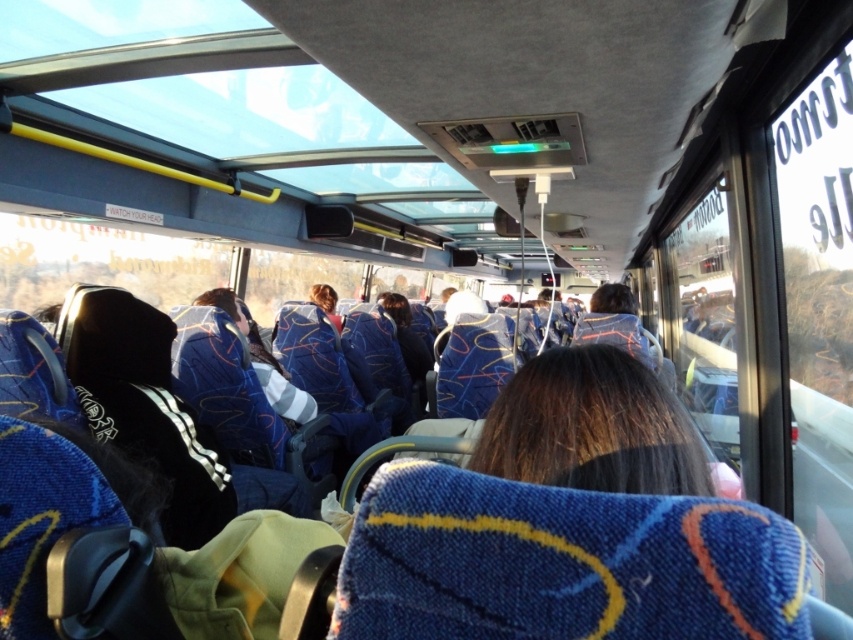
Question: In this image, where is brown hair at center located relative to blue fabric jacket at center?

Choices:
 (A) right
 (B) left

Answer: (A)

Question: Which object appears farthest from the camera in this image?

Choices:
 (A) blue fabric jacket at center
 (B) brown hair at center

Answer: (A)

Question: Is brown hair at center to the right of blue fabric jacket at center from the viewer's perspective?

Choices:
 (A) no
 (B) yes

Answer: (B)

Question: Does brown hair at center appear under blue fabric jacket at center?

Choices:
 (A) no
 (B) yes

Answer: (A)

Question: Which of the following is the closest to the observer?

Choices:
 (A) blue fabric jacket at center
 (B) brown hair at center

Answer: (B)